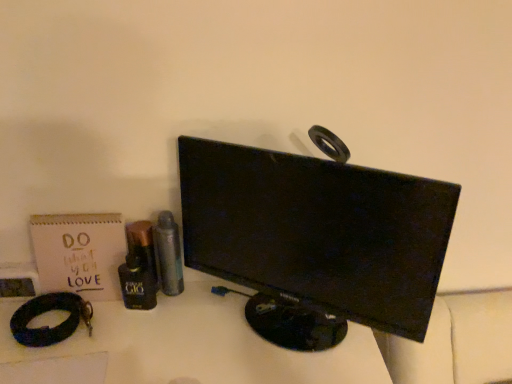
Question: Is matte paper notebook at left turned away from black leather bracelet at lower left?

Choices:
 (A) yes
 (B) no

Answer: (B)

Question: Could you tell me if matte paper notebook at left is facing black leather bracelet at lower left?

Choices:
 (A) no
 (B) yes

Answer: (B)

Question: Is matte paper notebook at left to the left of black leather bracelet at lower left from the viewer's perspective?

Choices:
 (A) yes
 (B) no

Answer: (B)

Question: From the image's perspective, is matte paper notebook at left located beneath black leather bracelet at lower left?

Choices:
 (A) yes
 (B) no

Answer: (B)

Question: Is matte paper notebook at left next to black leather bracelet at lower left?

Choices:
 (A) no
 (B) yes

Answer: (B)

Question: Is metallic silver spray can at center-left, marked as the 3th toiletry in a left-to-right arrangement, wider or thinner than shiny black bottle at center left, the 2th toiletry when ordered from right to left?

Choices:
 (A) wide
 (B) thin

Answer: (A)

Question: Considering the positions of point (164, 211) and point (145, 286), is point (164, 211) closer or farther from the camera than point (145, 286)?

Choices:
 (A) closer
 (B) farther

Answer: (A)

Question: From a real-world perspective, is metallic silver spray can at center-left, marked as the 3th toiletry in a left-to-right arrangement, physically located above or below shiny black bottle at center left, the second toiletry when ordered from left to right?

Choices:
 (A) above
 (B) below

Answer: (A)

Question: From the image's perspective, is metallic silver spray can at center-left, marked as the 3th toiletry in a left-to-right arrangement, located above or below shiny black bottle at center left, the second toiletry when ordered from left to right?

Choices:
 (A) above
 (B) below

Answer: (A)

Question: From a real-world perspective, is shiny black bottle at center left, the second toiletry when ordered from left to right, positioned above or below metallic silver spray can at center-left, placed as the first toiletry when sorted from right to left?

Choices:
 (A) above
 (B) below

Answer: (B)

Question: In the image, is shiny black bottle at center left, the second toiletry when ordered from left to right, positioned in front of or behind metallic silver spray can at center-left, placed as the first toiletry when sorted from right to left?

Choices:
 (A) front
 (B) behind

Answer: (A)

Question: Is shiny black bottle at center left, the 2th toiletry when ordered from right to left, situated inside metallic silver spray can at center-left, marked as the 3th toiletry in a left-to-right arrangement, or outside?

Choices:
 (A) outside
 (B) inside

Answer: (A)

Question: Looking at the image, does shiny black bottle at center left, the second toiletry when ordered from left to right, seem bigger or smaller compared to metallic silver spray can at center-left, marked as the 3th toiletry in a left-to-right arrangement?

Choices:
 (A) small
 (B) big

Answer: (B)

Question: Considering their positions, is black leather bracelet at lower left located in front of or behind metallic silver spray can at center-left, placed as the first toiletry when sorted from right to left?

Choices:
 (A) front
 (B) behind

Answer: (A)

Question: In terms of size, does black leather bracelet at lower left appear bigger or smaller than metallic silver spray can at center-left, marked as the 3th toiletry in a left-to-right arrangement?

Choices:
 (A) small
 (B) big

Answer: (B)